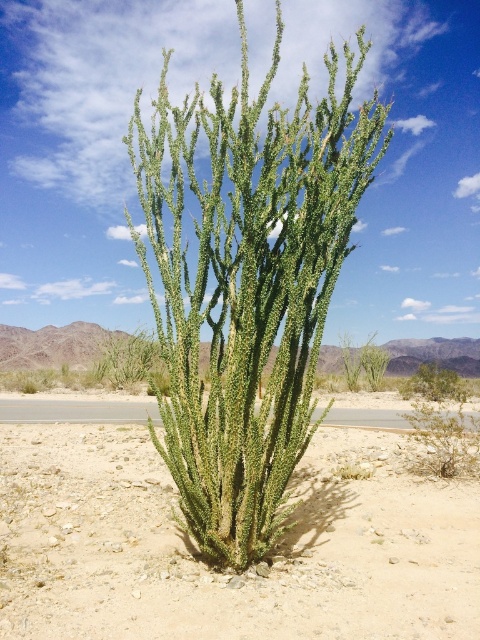
Consider the image. You are a desert explorer and you need to place a small tent. You have two options for the location of the tent. The first option is to place it on the light brown gravel at center. The second option is to place it on the surrounding desert sand. Which location would provide a more stable base for the tent?

The light brown gravel at center would provide a more stable base for the tent because gravel typically offers better stability compared to loose desert sand.

You are standing in the desert and see the light brown gravel at center and the green spiny cactus at center. Which one is nearer to you?

The light brown gravel at center is closer to the viewer than the green spiny cactus at center.

You are standing in a desert scene and see a point marked at coordinates (228, 573). According to the image, what does this point represent?

The point at (228, 573) represents the location of the light brown gravel at center.